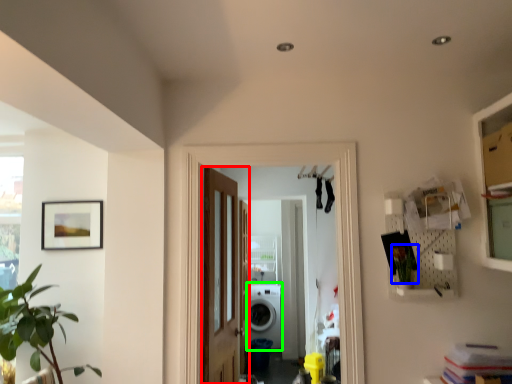
Question: Which object is the closest to the door (highlighted by a red box)? Choose among these: plant (highlighted by a blue box) or washing machine (highlighted by a green box).

Choices:
 (A) plant
 (B) washing machine

Answer: (A)